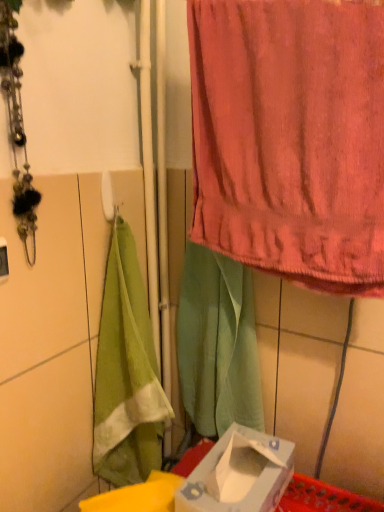
This screenshot has height=512, width=384. Describe the element at coordinates (239, 474) in the screenshot. I see `white cardboard box at lower center` at that location.

Where is `green fabric at center`? Image resolution: width=384 pixels, height=512 pixels. green fabric at center is located at coordinates (x=218, y=343).

Describe the element at coordinates (291, 138) in the screenshot. I see `pink terry cloth towel at upper right` at that location.

I want to click on white cardboard box at lower center, so click(x=239, y=474).

Considering the relative positions of white cardboard box at lower center and pink terry cloth towel at upper right in the image provided, is white cardboard box at lower center to the left of pink terry cloth towel at upper right from the viewer's perspective?

Indeed, white cardboard box at lower center is positioned on the left side of pink terry cloth towel at upper right.

Is point (219, 488) positioned behind point (253, 137)?

Yes, it is behind point (253, 137).

Considering the relative positions of white cardboard box at lower center and pink terry cloth towel at upper right in the image provided, is white cardboard box at lower center behind pink terry cloth towel at upper right?

Yes, the depth of white cardboard box at lower center is greater than that of pink terry cloth towel at upper right.

Based on the photo, from a real-world perspective, which is physically above, white cardboard box at lower center or pink terry cloth towel at upper right?

pink terry cloth towel at upper right, from a real-world perspective.

What's the angular difference between white cardboard box at lower center and green fabric at center's facing directions?

0.887 degrees.

Considering the positions of objects white cardboard box at lower center and green fabric at center in the image provided, who is more to the right, white cardboard box at lower center or green fabric at center?

white cardboard box at lower center.

Which of these two, white cardboard box at lower center or green fabric at center, is wider?

white cardboard box at lower center is wider.

Is white cardboard box at lower center closer to camera compared to green fabric at center?

Yes, it is.

Considering the relative sizes of pink terry cloth towel at upper right and green fabric at center in the image provided, is pink terry cloth towel at upper right taller than green fabric at center?

No, pink terry cloth towel at upper right is not taller than green fabric at center.

Where is `cloth lying below the pink terry cloth towel at upper right (from the image's perspective)`? cloth lying below the pink terry cloth towel at upper right (from the image's perspective) is located at coordinates (218, 343).

Are pink terry cloth towel at upper right and green fabric at center beside each other?

pink terry cloth towel at upper right is not next to green fabric at center, and they're not touching.

Is pink terry cloth towel at upper right not inside white cardboard box at lower center?

Yes, pink terry cloth towel at upper right is not within white cardboard box at lower center.

Does point (368, 17) appear closer or farther from the camera than point (282, 482)?

Point (368, 17).

From a real-world perspective, is pink terry cloth towel at upper right positioned above or below white cardboard box at lower center?

Clearly, from a real-world perspective, pink terry cloth towel at upper right is above white cardboard box at lower center.

I want to click on curtain in front of the green fabric at center, so [x=291, y=138].

Is point (203, 269) positioned in front of point (299, 11)?

No, it is behind (299, 11).

Between green fabric at center and pink terry cloth towel at upper right, which one has smaller size?

green fabric at center is smaller.

Considering the sizes of green fabric at center and pink terry cloth towel at upper right in the image, is green fabric at center wider or thinner than pink terry cloth towel at upper right?

green fabric at center is wider than pink terry cloth towel at upper right.

Is green fabric at center oriented away from white cardboard box at lower center?

No, green fabric at center is not facing the opposite direction of white cardboard box at lower center.

Would you say green fabric at center is a long distance from white cardboard box at lower center?

That's not correct — green fabric at center is a little close to white cardboard box at lower center.

From the image's perspective, would you say green fabric at center is positioned over white cardboard box at lower center?

Yes, from the image's perspective, green fabric at center is on top of white cardboard box at lower center.

Does green fabric at center lie in front of white cardboard box at lower center?

No, green fabric at center is further to the viewer.

What are the coordinates of `box that is below the pink terry cloth towel at upper right (from the image's perspective)` in the screenshot? It's located at (239, 474).

I want to click on box below the green fabric at center (from a real-world perspective), so click(x=239, y=474).

Looking at the image, which one is located further to white cardboard box at lower center, green fabric at center or pink terry cloth towel at upper right?

Among the two, pink terry cloth towel at upper right is located further to white cardboard box at lower center.

Considering their positions, is pink terry cloth towel at upper right positioned closer to white cardboard box at lower center than green fabric at center?

green fabric at center lies closer to white cardboard box at lower center than the other object.

Which object lies further to the anchor point green fabric at center, pink terry cloth towel at upper right or white cardboard box at lower center?

The object further to green fabric at center is pink terry cloth towel at upper right.

Looking at the image, which one is located further to pink terry cloth towel at upper right, white cardboard box at lower center or green fabric at center?

Among the two, white cardboard box at lower center is located further to pink terry cloth towel at upper right.

From the image, which object appears to be nearer to green fabric at center, white cardboard box at lower center or pink terry cloth towel at upper right?

white cardboard box at lower center is closer to green fabric at center.

Which object lies further to the anchor point pink terry cloth towel at upper right, green fabric at center or white cardboard box at lower center?

Among the two, white cardboard box at lower center is located further to pink terry cloth towel at upper right.

Where is `cloth between pink terry cloth towel at upper right and white cardboard box at lower center vertically`? The height and width of the screenshot is (512, 384). cloth between pink terry cloth towel at upper right and white cardboard box at lower center vertically is located at coordinates (218, 343).